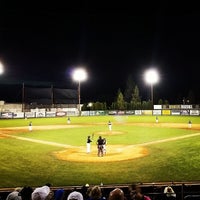
At what (x,y) coordinates should I click in order to perform the action: click on lights. Please return your answer as a coordinate pair (x, y). This screenshot has width=200, height=200. Looking at the image, I should click on (150, 76), (79, 73), (1, 67).